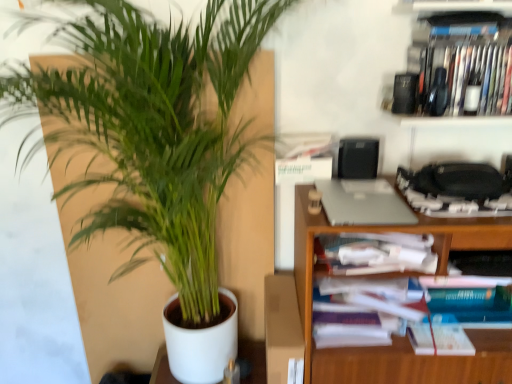
Question: From the image's perspective, is silver metallic laptop at upper right positioned above or below metallic silver cabinet at upper right?

Choices:
 (A) below
 (B) above

Answer: (A)

Question: In the image, is silver metallic laptop at upper right positioned in front of or behind metallic silver cabinet at upper right?

Choices:
 (A) behind
 (B) front

Answer: (B)

Question: Considering the real-world distances, which object is closest to the metallic silver cabinet at upper right?

Choices:
 (A) black plastic speaker at upper right
 (B) silver metallic laptop at upper right
 (C) green leafy plant at left
 (D) white paper book at center right

Answer: (A)

Question: Estimate the real-world distances between objects in this image. Which object is closer to the black plastic speaker at upper right?

Choices:
 (A) silver metallic laptop at upper right
 (B) green leafy plant at left
 (C) white paper book at center right
 (D) metallic silver cabinet at upper right

Answer: (A)